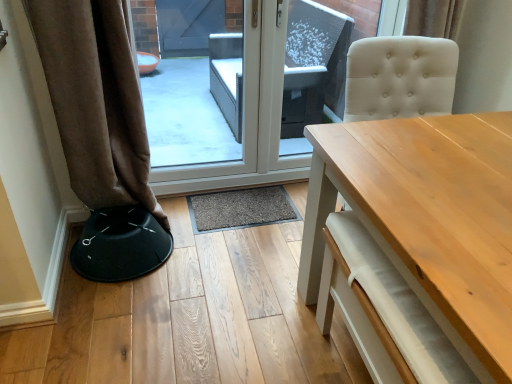
Question: From the image's perspective, is light wood table at center located beneath transparent glass door at center?

Choices:
 (A) no
 (B) yes

Answer: (B)

Question: Can you confirm if light wood table at center is wider than transparent glass door at center?

Choices:
 (A) yes
 (B) no

Answer: (A)

Question: Is light wood table at center behind transparent glass door at center?

Choices:
 (A) no
 (B) yes

Answer: (A)

Question: Is light wood table at center turned away from transparent glass door at center?

Choices:
 (A) no
 (B) yes

Answer: (A)

Question: From the image's perspective, is light wood table at center located above transparent glass door at center?

Choices:
 (A) no
 (B) yes

Answer: (A)

Question: Looking at their shapes, would you say transparent glass door at center is wider or thinner than light wood table at center?

Choices:
 (A) wide
 (B) thin

Answer: (B)

Question: Choose the correct answer: Is transparent glass door at center inside light wood table at center or outside it?

Choices:
 (A) outside
 (B) inside

Answer: (A)

Question: Is point (237, 175) positioned closer to the camera than point (394, 213)?

Choices:
 (A) farther
 (B) closer

Answer: (A)

Question: In the image, is transparent glass door at center on the left side or the right side of light wood table at center?

Choices:
 (A) left
 (B) right

Answer: (A)

Question: In terms of size, does black fabric bar stool at lower left appear bigger or smaller than brown fabric curtain at left?

Choices:
 (A) big
 (B) small

Answer: (B)

Question: From the image's perspective, is black fabric bar stool at lower left positioned above or below brown fabric curtain at left?

Choices:
 (A) above
 (B) below

Answer: (B)

Question: In the image, is black fabric bar stool at lower left positioned in front of or behind brown fabric curtain at left?

Choices:
 (A) front
 (B) behind

Answer: (B)

Question: Is black fabric bar stool at lower left inside or outside of brown fabric curtain at left?

Choices:
 (A) outside
 (B) inside

Answer: (A)

Question: Is black fabric bar stool at lower left situated inside light wood table at center or outside?

Choices:
 (A) outside
 (B) inside

Answer: (A)

Question: Is black fabric bar stool at lower left taller or shorter than light wood table at center?

Choices:
 (A) tall
 (B) short

Answer: (B)